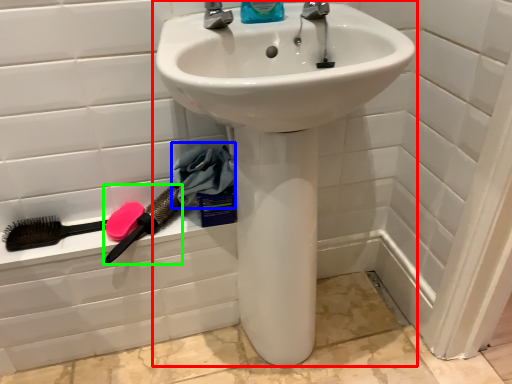
Question: Which object is the closest to the sink (highlighted by a red box)? Choose among these: material (highlighted by a blue box) or brush (highlighted by a green box).

Choices:
 (A) material
 (B) brush

Answer: (A)